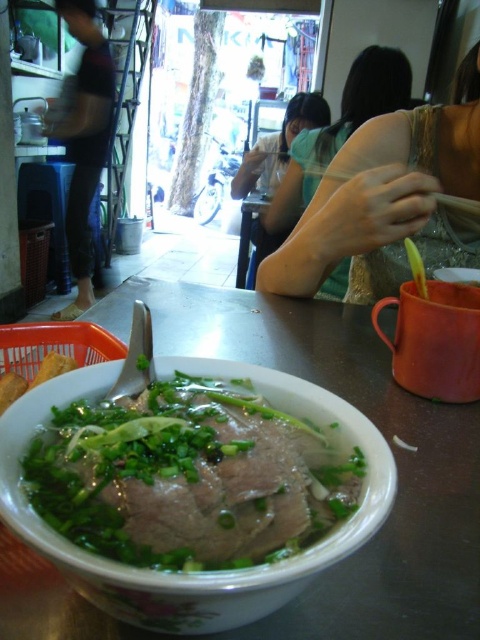
You are a customer at the eatery and want to reach both the dark blue jeans at left and the wooden chopsticks at upper right. Which item is closer to you?

The dark blue jeans at left is closer to you because the wooden chopsticks at upper right is behind it, meaning the jeans are in front.

You are a customer at the eatery and want to place your wooden chopsticks at upper right on the table. Can you fit them on the dark blue jeans at left without overlapping?

The dark blue jeans at left is bigger than wooden chopsticks at upper right, so yes, the wooden chopsticks at upper right can fit on the dark blue jeans at left without overlapping.

You are a food photographer who wants to capture a closeup shot of the white glossy stew at center. Your camera can focus on objects within 8 inches. Can you take the photo without moving the stew or the camera?

The white glossy stew at center is 9.01 inches away from camera, which is beyond the camera focus range of 8 inches. Therefore, you cannot take the photo without moving the stew or the camera.